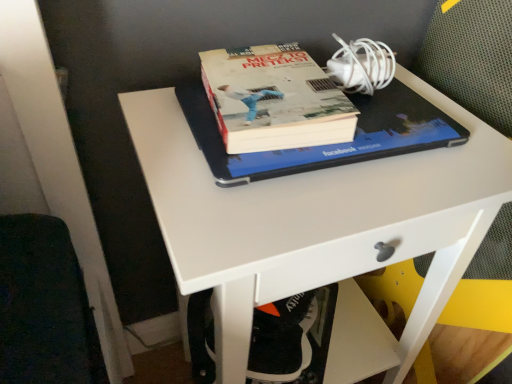
Question: Should I look upward or downward to see white matte desk at center?

Choices:
 (A) down
 (B) up

Answer: (A)

Question: Does hardcover book at center have a lesser width compared to white plastic swivel chair at lower center?

Choices:
 (A) no
 (B) yes

Answer: (B)

Question: Is hardcover book at center completely or partially outside of white plastic swivel chair at lower center?

Choices:
 (A) no
 (B) yes

Answer: (B)

Question: Does hardcover book at center have a greater width compared to white plastic swivel chair at lower center?

Choices:
 (A) no
 (B) yes

Answer: (A)

Question: Is hardcover book at center oriented away from white plastic swivel chair at lower center?

Choices:
 (A) yes
 (B) no

Answer: (B)

Question: From a real-world perspective, does hardcover book at center stand above white plastic swivel chair at lower center?

Choices:
 (A) yes
 (B) no

Answer: (A)

Question: From a real-world perspective, is hardcover book at center located beneath white plastic swivel chair at lower center?

Choices:
 (A) yes
 (B) no

Answer: (B)

Question: Does white plastic swivel chair at lower center have a lesser height compared to white matte desk at center?

Choices:
 (A) no
 (B) yes

Answer: (B)

Question: Is white plastic swivel chair at lower center positioned behind white matte desk at center?

Choices:
 (A) no
 (B) yes

Answer: (B)

Question: Is white plastic swivel chair at lower center not near white matte desk at center?

Choices:
 (A) no
 (B) yes

Answer: (A)

Question: Is white plastic swivel chair at lower center located outside white matte desk at center?

Choices:
 (A) no
 (B) yes

Answer: (A)

Question: Can you confirm if white plastic swivel chair at lower center is positioned to the left of white matte desk at center?

Choices:
 (A) no
 (B) yes

Answer: (B)

Question: Can you confirm if white plastic swivel chair at lower center is smaller than white matte desk at center?

Choices:
 (A) yes
 (B) no

Answer: (A)

Question: Can you confirm if white plastic swivel chair at lower center is bigger than hardcover book at center?

Choices:
 (A) yes
 (B) no

Answer: (A)